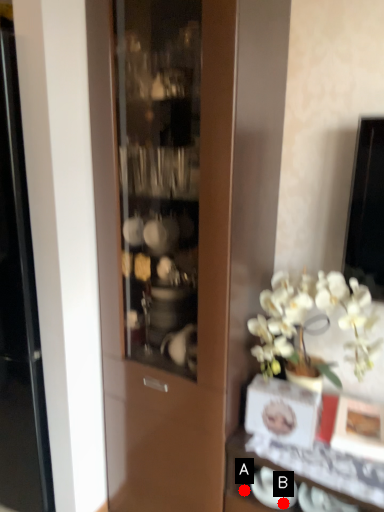
Question: Two points are circled on the image, labeled by A and B beside each circle. Which of the following is the closest to the observer?

Choices:
 (A) A is closer
 (B) B is closer

Answer: (B)